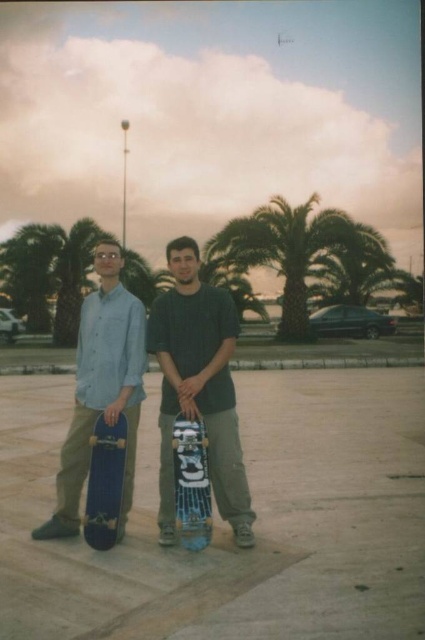
Does matte black skateboard at center have a lesser width compared to matte blue skateboard at left?

Yes.

Who is positioned more to the right, matte black skateboard at center or matte blue skateboard at left?

matte black skateboard at center

Where is `matte black skateboard at center`? matte black skateboard at center is located at coordinates (198, 387).

Between matte blue skateboard at left and blue matte skateboard at left, which one appears on the left side from the viewer's perspective?

From the viewer's perspective, matte blue skateboard at left appears more on the left side.

Does matte blue skateboard at left have a lesser height compared to blue matte skateboard at left?

No.

Identify the location of matte blue skateboard at left. The image size is (425, 640). (102, 388).

The image size is (425, 640). Find the location of `matte blue skateboard at left`. matte blue skateboard at left is located at coordinates (102, 388).

Does matte blue skateboard at left appear on the right side of blue glossy skateboard at center?

In fact, matte blue skateboard at left is to the left of blue glossy skateboard at center.

Can you confirm if matte blue skateboard at left is taller than blue glossy skateboard at center?

Yes.

Identify the location of matte blue skateboard at left. (102, 388).